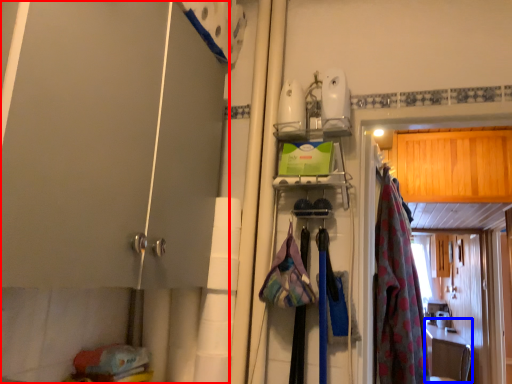
Question: Which object is closer to the camera taking this photo, door (highlighted by a red box) or counter top (highlighted by a blue box)?

Choices:
 (A) door
 (B) counter top

Answer: (A)